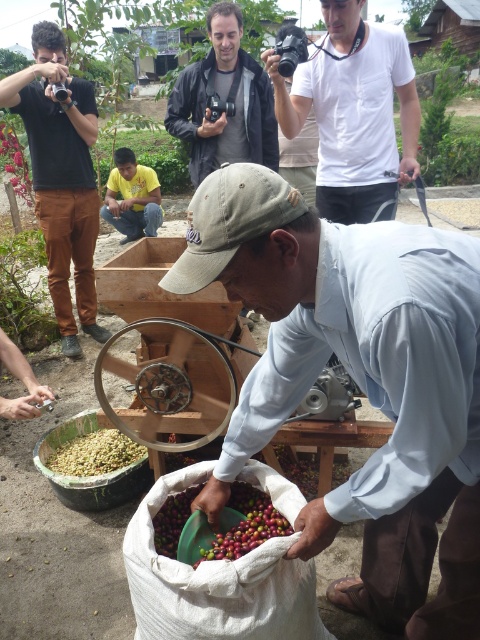
Who is positioned more to the right, white cotton shirt at upper center or matte black camera at upper left?

white cotton shirt at upper center

Between point (348, 147) and point (83, 275), which one is positioned behind?

The point (83, 275) is behind.

Find the location of a particular element. This screenshot has width=480, height=640. white cotton shirt at upper center is located at coordinates (352, 112).

Image resolution: width=480 pixels, height=640 pixels. I want to click on white cotton shirt at upper center, so click(352, 112).

Can you confirm if light brown cotton shirt at center is bigger than matte black camera at upper left?

Incorrect, light brown cotton shirt at center is not larger than matte black camera at upper left.

Is light brown cotton shirt at center smaller than matte black camera at upper left?

Yes, light brown cotton shirt at center is smaller than matte black camera at upper left.

Describe the element at coordinates (358, 381) in the screenshot. I see `light brown cotton shirt at center` at that location.

Locate an element on the screen. light brown cotton shirt at center is located at coordinates (x=358, y=381).

Does matte black jacket at center have a lesser height compared to green matte coffee beans at center?

In fact, matte black jacket at center may be taller than green matte coffee beans at center.

Does matte black jacket at center have a greater height compared to green matte coffee beans at center?

Yes.

This screenshot has height=640, width=480. Describe the element at coordinates (224, 99) in the screenshot. I see `matte black jacket at center` at that location.

This screenshot has width=480, height=640. Find the location of `matte black jacket at center`. matte black jacket at center is located at coordinates (224, 99).